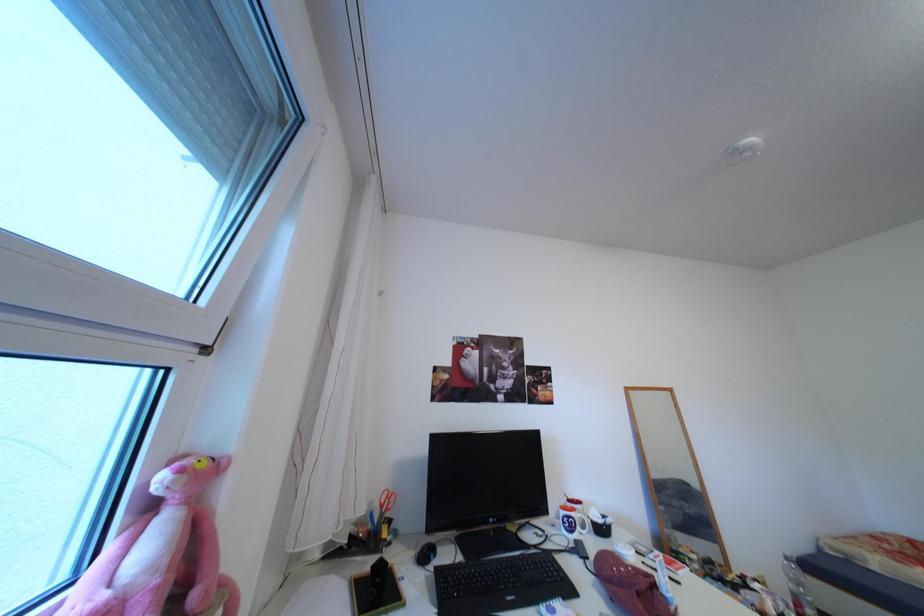
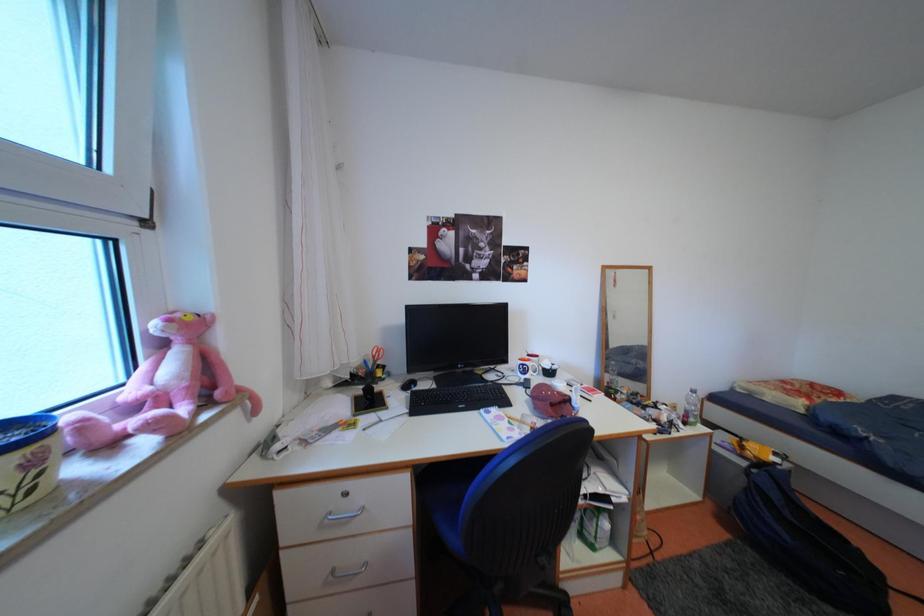
Question: The first image is from the beginning of the video and the second image is from the end. How did the camera likely rotate when shooting the video?

Choices:
 (A) Left
 (B) Right
 (C) Up
 (D) Down

Answer: (D)